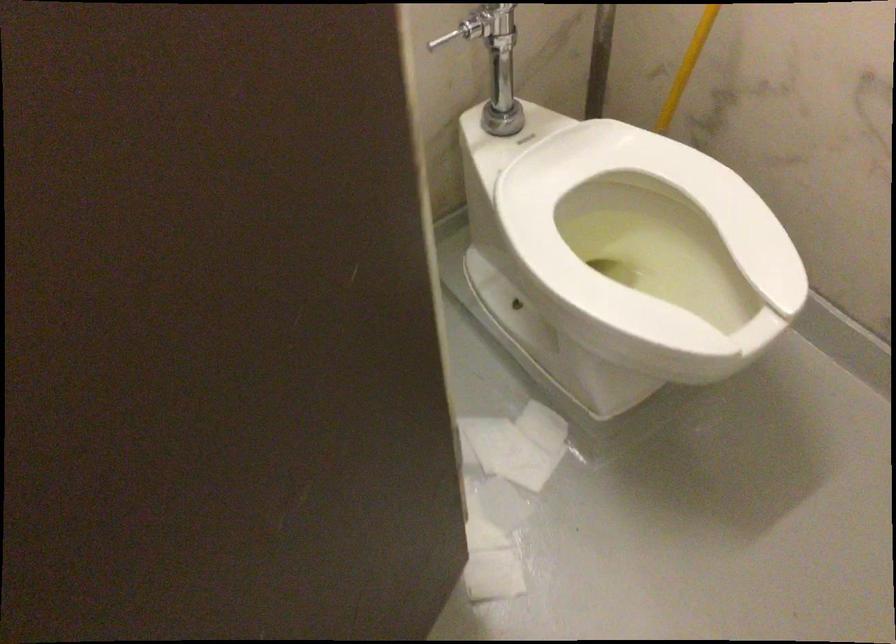
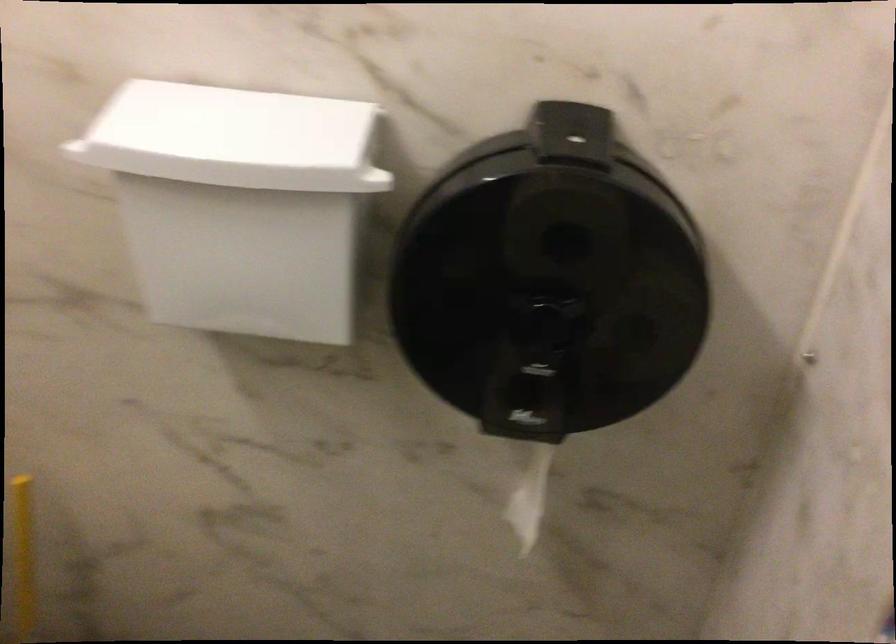
Question: Based on the continuous images, in which direction is the camera rotating? Reply with the corresponding letter.

Choices:
 (A) Left
 (B) Right
 (C) Up
 (D) Down

Answer: (B)